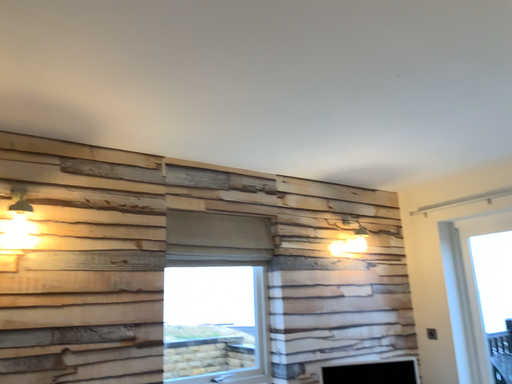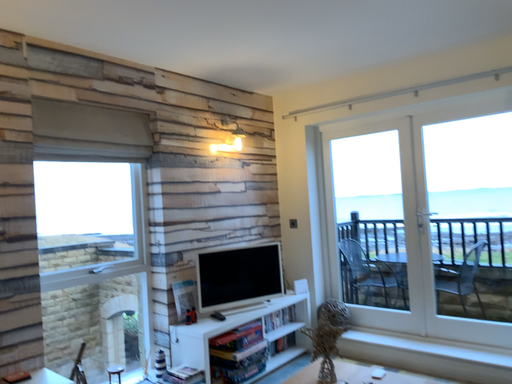
Question: How did the camera likely rotate when shooting the video?

Choices:
 (A) rotated left
 (B) rotated right

Answer: (B)